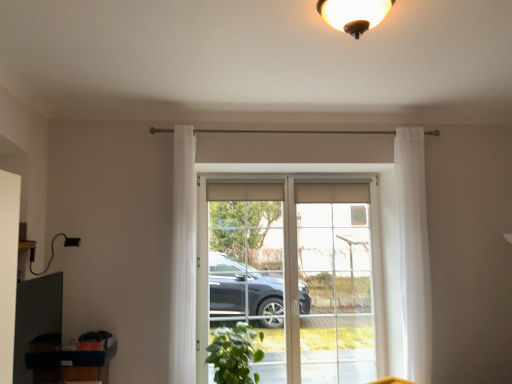
Question: Is clear glass door at center bigger or smaller than clear glass screen door at center?

Choices:
 (A) big
 (B) small

Answer: (A)

Question: Would you say clear glass door at center is to the left or to the right of clear glass screen door at center in the picture?

Choices:
 (A) right
 (B) left

Answer: (A)

Question: Based on their relative distances, which object is nearer to the white sheer curtain at center, which ranks as the first curtain in left-to-right order?

Choices:
 (A) matte gold light fixture at upper center
 (B) white sheer curtain at right, placed as the 2th curtain when sorted from left to right
 (C) clear glass screen door at center
 (D) clear glass door at center
 (E) clear glass window at center

Answer: (E)

Question: Based on their relative distances, which object is nearer to the matte gold light fixture at upper center?

Choices:
 (A) green leafy plant at lower center
 (B) clear glass door at center
 (C) white sheer curtain at center, marked as the second curtain in a right-to-left arrangement
 (D) clear glass screen door at center
 (E) clear glass window at center

Answer: (C)